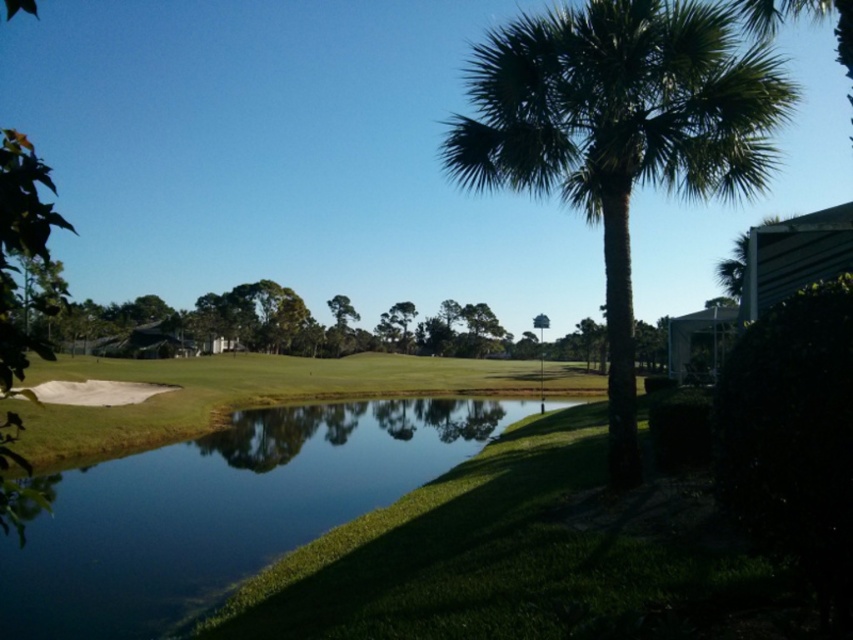
You are standing on the golf course and see two points marked on the ground. The first point is at coordinate point (80, 564) and the second is at point (688, 76). Which point is closer to you?

Point (80, 564) is further to the viewer than point (688, 76), so the point closer to you is point (688, 76).

You are a golfer standing at the tee, looking towards the green leafy palm tree at right and the clear water at pond center. Which object is nearer to you?

The clear water at pond center is closer to the viewer than the green leafy palm tree at right.